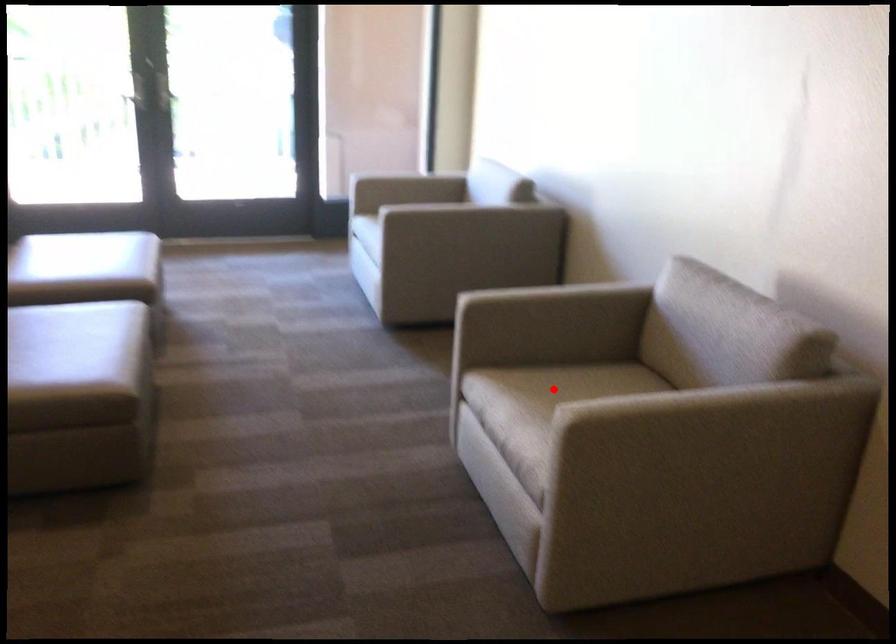
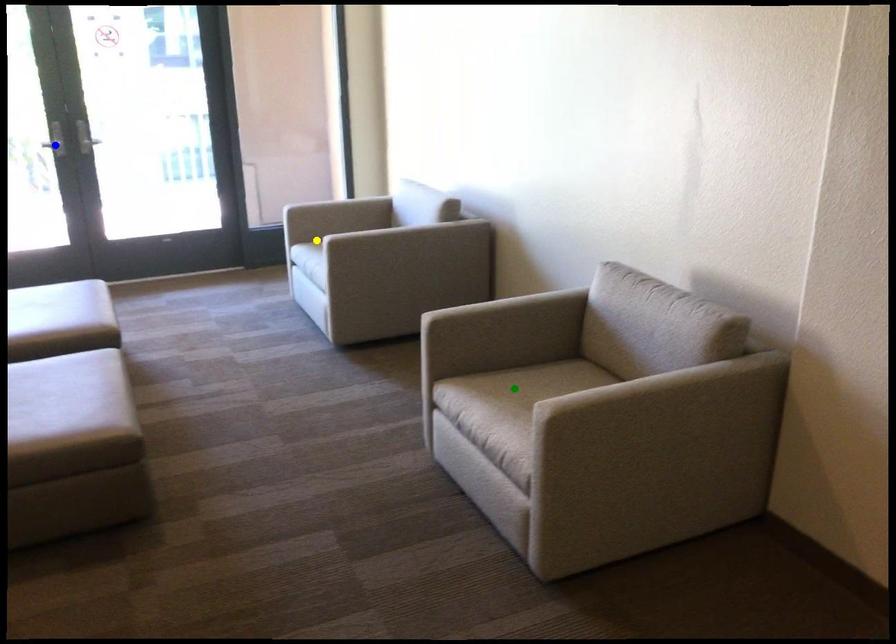
Question: I am providing you with two images of the same scene from different viewpoints. A red point is marked on the first image. You are given multiple points on the second image. Which mark in image 2 goes with the point in image 1?

Choices:
 (A) green point
 (B) blue point
 (C) yellow point

Answer: (A)